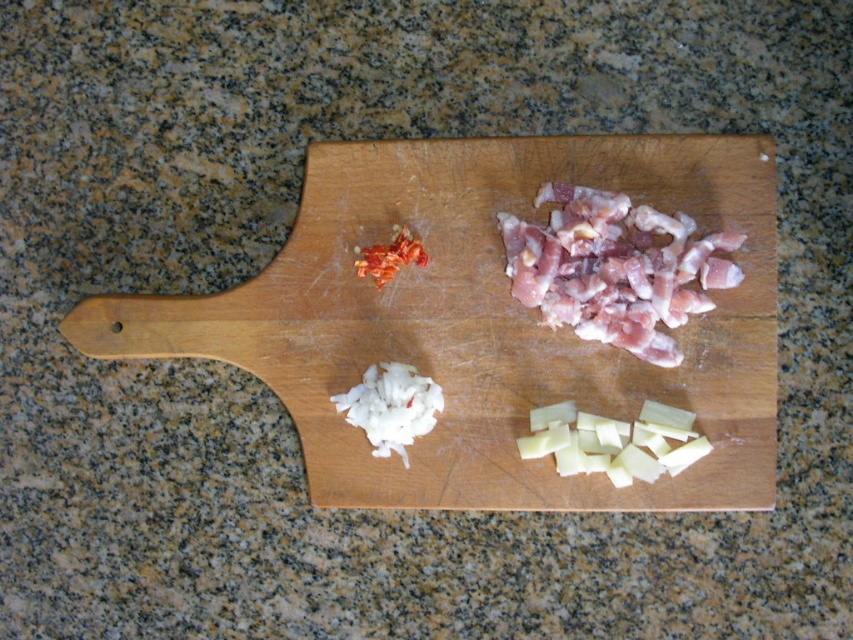
Question: Which point is closer to the camera?

Choices:
 (A) pinkish raw meat at upper right
 (B) wooden cutting board at center

Answer: (B)

Question: Can you confirm if wooden cutting board at center is thinner than pinkish raw meat at upper right?

Choices:
 (A) no
 (B) yes

Answer: (A)

Question: Estimate the real-world distances between objects in this image. Which object is farther from the white creamy cheese at bottom right?

Choices:
 (A) wooden cutting board at center
 (B) bright red dried chili at upper center
 (C) pinkish raw meat at upper right

Answer: (B)

Question: Considering the real-world distances, which object is closest to the white sliced onion at center?

Choices:
 (A) bright red dried chili at upper center
 (B) wooden cutting board at center
 (C) white creamy cheese at bottom right
 (D) pinkish raw meat at upper right

Answer: (A)

Question: From the image, what is the correct spatial relationship of white sliced onion at center in relation to bright red dried chili at upper center?

Choices:
 (A) below
 (B) above

Answer: (A)

Question: Is the position of pinkish raw meat at upper right more distant than that of white sliced onion at center?

Choices:
 (A) yes
 (B) no

Answer: (B)